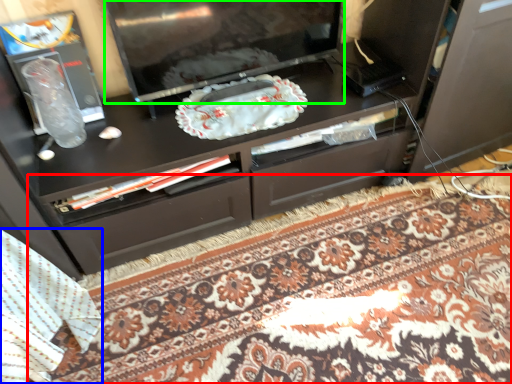
Question: Which object is the farthest from mat (highlighted by a red box)? Choose among these: blanket (highlighted by a blue box) or television (highlighted by a green box).

Choices:
 (A) blanket
 (B) television

Answer: (B)